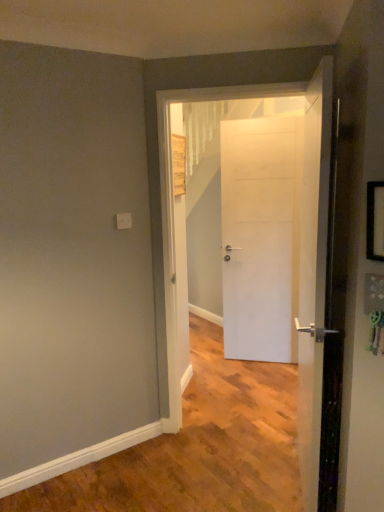
Question: Is black plastic picture frame at right closer to camera compared to white matte door at center, positioned as the 3th door in back-to-front order?

Choices:
 (A) yes
 (B) no

Answer: (A)

Question: Is black plastic picture frame at right not near white matte door at center, which appears as the first door when viewed from the front?

Choices:
 (A) no
 (B) yes

Answer: (A)

Question: From the image's perspective, is black plastic picture frame at right located above white matte door at center, which appears as the first door when viewed from the front?

Choices:
 (A) yes
 (B) no

Answer: (A)

Question: Does black plastic picture frame at right appear on the right side of white matte door at center, positioned as the 3th door in back-to-front order?

Choices:
 (A) yes
 (B) no

Answer: (A)

Question: Considering the relative sizes of black plastic picture frame at right and white matte door at center, positioned as the 3th door in back-to-front order, in the image provided, is black plastic picture frame at right bigger than white matte door at center, positioned as the 3th door in back-to-front order,?

Choices:
 (A) no
 (B) yes

Answer: (A)

Question: From the image's perspective, is white matte door at center, positioned as the 1th door in back-to-front order, above or below white matte door at center, acting as the 2th door starting from the back?

Choices:
 (A) below
 (B) above

Answer: (B)

Question: Considering the relative positions of white matte door at center, positioned as the 1th door in back-to-front order, and white matte door at center, arranged as the 2th door when viewed from the front, in the image provided, is white matte door at center, positioned as the 1th door in back-to-front order, to the left or to the right of white matte door at center, arranged as the 2th door when viewed from the front,?

Choices:
 (A) left
 (B) right

Answer: (B)

Question: Considering the positions of white matte door at center, arranged as the 3th door when viewed from the front, and white matte door at center, acting as the 2th door starting from the back, in the image, is white matte door at center, arranged as the 3th door when viewed from the front, taller or shorter than white matte door at center, acting as the 2th door starting from the back,?

Choices:
 (A) tall
 (B) short

Answer: (B)

Question: In the image, is white matte door at center, arranged as the 3th door when viewed from the front, positioned in front of or behind white matte door at center, acting as the 2th door starting from the back?

Choices:
 (A) behind
 (B) front

Answer: (A)

Question: From a real-world perspective, is white matte door at center, positioned as the 1th door in back-to-front order, above or below black plastic picture frame at right?

Choices:
 (A) above
 (B) below

Answer: (B)

Question: Choose the correct answer: Is white matte door at center, arranged as the 3th door when viewed from the front, inside black plastic picture frame at right or outside it?

Choices:
 (A) inside
 (B) outside

Answer: (B)

Question: Is white matte door at center, arranged as the 3th door when viewed from the front, in front of or behind black plastic picture frame at right in the image?

Choices:
 (A) behind
 (B) front

Answer: (A)

Question: From the image's perspective, relative to black plastic picture frame at right, is white matte door at center, positioned as the 1th door in back-to-front order, above or below?

Choices:
 (A) above
 (B) below

Answer: (B)

Question: Based on their sizes in the image, would you say white matte door at center, which appears as the first door when viewed from the front, is bigger or smaller than black plastic picture frame at right?

Choices:
 (A) big
 (B) small

Answer: (A)

Question: Is white matte door at center, positioned as the 3th door in back-to-front order, spatially inside black plastic picture frame at right, or outside of it?

Choices:
 (A) outside
 (B) inside

Answer: (A)